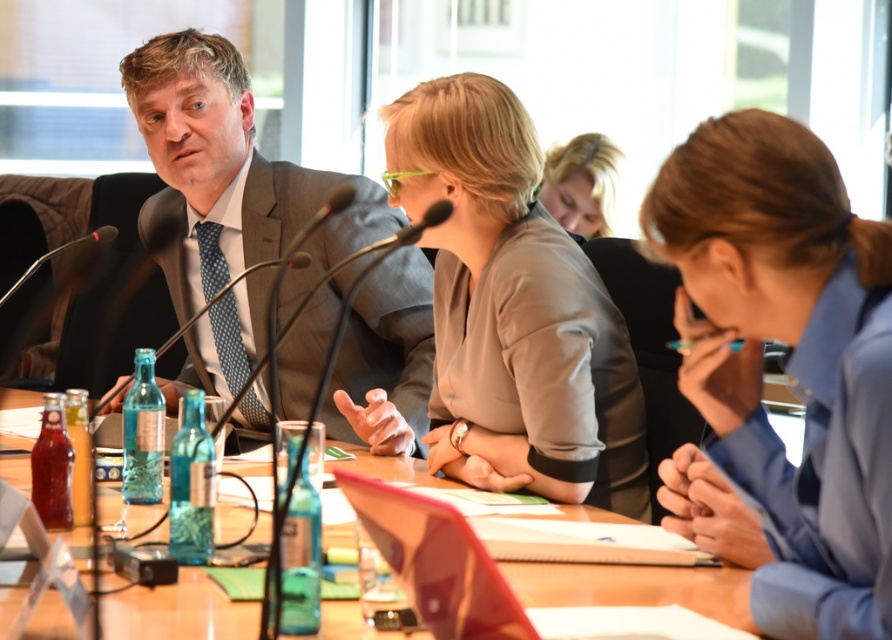
Which of these two, translucent glass table at center or blonde hair at upper center, stands taller?

With more height is blonde hair at upper center.

Is point (23, 483) in front of point (606, 202)?

Yes, it is.

Is point (6, 474) more distant than point (601, 205)?

No, it is in front of (601, 205).

Where is `translucent glass table at center`? Image resolution: width=892 pixels, height=640 pixels. translucent glass table at center is located at coordinates (625, 586).

Looking at this image, between matte gray blouse at center and blonde hair at upper center, which one is positioned higher?

Positioned higher is blonde hair at upper center.

Who is more distant from viewer, (506, 268) or (544, 204)?

Point (544, 204)

Does point (537, 264) come farther from viewer compared to point (606, 179)?

No, it is not.

Where is `matte gray blouse at center`? The height and width of the screenshot is (640, 892). matte gray blouse at center is located at coordinates (513, 308).

Measure the distance between matte gray blouse at center and matte gray suit at center.

A distance of 18.20 inches exists between matte gray blouse at center and matte gray suit at center.

Does point (450, 467) come farther from viewer compared to point (241, 227)?

No.

Locate an element on the screen. This screenshot has width=892, height=640. matte gray blouse at center is located at coordinates (513, 308).